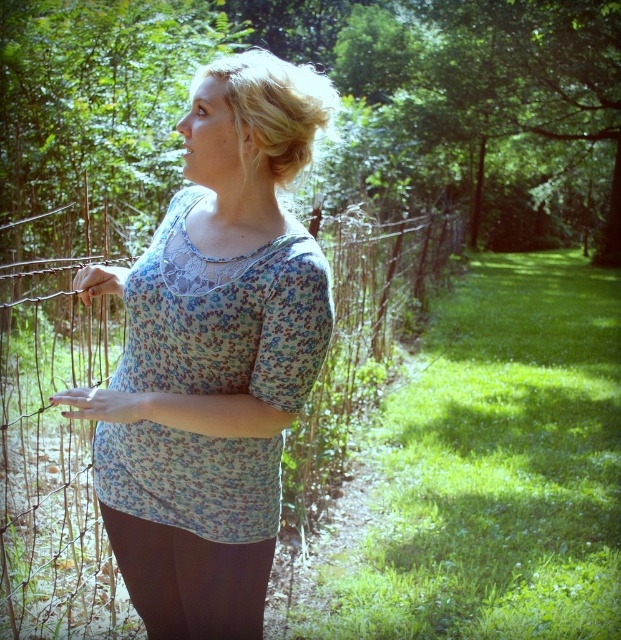
You are standing at point (168,612) and want to walk to the person leaning against the rustic wooden fence in the scene. Which direction should you move relative to point (176,568)?

You should move towards point (176,568) because it is in front of point (168,612), meaning it is closer to the person leaning against the rustic wooden fence.